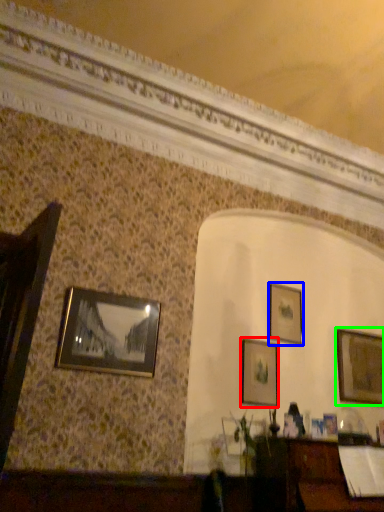
Question: Estimate the real-world distances between objects in this image. Which object is farther from picture frame (highlighted by a red box), picture frame (highlighted by a blue box) or picture frame (highlighted by a green box)?

Choices:
 (A) picture frame
 (B) picture frame

Answer: (B)